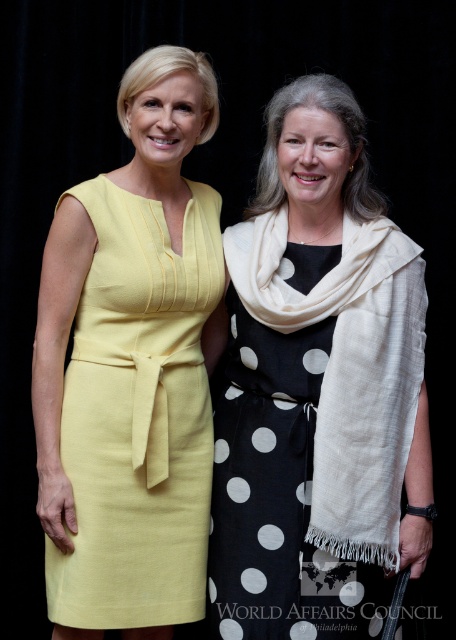
Question: Is matte yellow dress at left further to camera compared to black dotted dress at center?

Choices:
 (A) yes
 (B) no

Answer: (A)

Question: Can you confirm if matte yellow dress at left is positioned to the right of black dotted dress at center?

Choices:
 (A) no
 (B) yes

Answer: (A)

Question: Considering the relative positions of matte yellow dress at left and black dotted dress at center in the image provided, where is matte yellow dress at left located with respect to black dotted dress at center?

Choices:
 (A) below
 (B) above

Answer: (B)

Question: Which of the following is the farthest from the observer?

Choices:
 (A) (205, 516)
 (B) (317, 280)

Answer: (A)